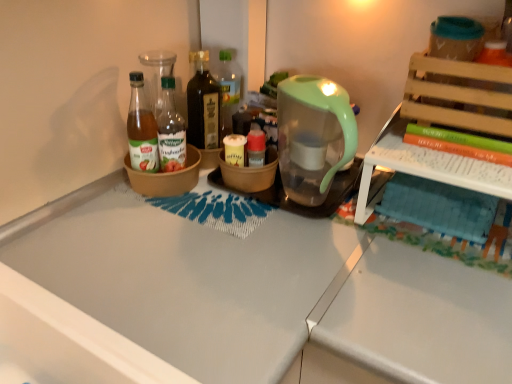
What do you see at coordinates (313, 136) in the screenshot?
I see `translucent green coffeepot at upper right` at bounding box center [313, 136].

What do you see at coordinates (228, 87) in the screenshot?
I see `translucent glass bottle at center, acting as the 3th bottle starting from the left` at bounding box center [228, 87].

Describe the element at coordinates (203, 104) in the screenshot. The width and height of the screenshot is (512, 384). I see `dark brown glass bottle at center, placed as the 2th bottle when sorted from left to right` at that location.

Where is `green glass bottle at center, which is the 1th bottle from left to right`? Image resolution: width=512 pixels, height=384 pixels. green glass bottle at center, which is the 1th bottle from left to right is located at coordinates click(170, 130).

Find the location of a particular element. Image resolution: width=512 pixels, height=384 pixels. green matte book at upper right is located at coordinates (460, 143).

This screenshot has width=512, height=384. Find the location of `translucent green coffeepot at upper right`. translucent green coffeepot at upper right is located at coordinates (313, 136).

Can you confirm if green matte book at upper right is positioned to the right of green glass bottle at center, which is counted as the third bottle, starting from the right?

Correct, you'll find green matte book at upper right to the right of green glass bottle at center, which is counted as the third bottle, starting from the right.

Identify the location of book in front of the green glass bottle at center, which is counted as the third bottle, starting from the right. (460, 143).

Can you see green matte book at upper right touching green glass bottle at center, which is counted as the third bottle, starting from the right?

There is a gap between green matte book at upper right and green glass bottle at center, which is counted as the third bottle, starting from the right.

Who is smaller, green glass bottle at center, which is counted as the third bottle, starting from the right, or translucent glass bottle at center, acting as the 3th bottle starting from the left?

Smaller between the two is green glass bottle at center, which is counted as the third bottle, starting from the right.

Is green glass bottle at center, which is the 1th bottle from left to right, outside of translucent glass bottle at center, which ranks as the first bottle in right-to-left order?

green glass bottle at center, which is the 1th bottle from left to right, lies outside translucent glass bottle at center, which ranks as the first bottle in right-to-left order,'s area.

Is point (182, 162) less distant than point (224, 61)?

That is True.

Looking at their sizes, would you say green glass bottle at center, which is counted as the third bottle, starting from the right, is wider or thinner than translucent glass bottle at center, which ranks as the first bottle in right-to-left order?

Considering their sizes, green glass bottle at center, which is counted as the third bottle, starting from the right, looks slimmer than translucent glass bottle at center, which ranks as the first bottle in right-to-left order.

In the scene shown: Considering the relative positions of brown matte bowl at center, acting as the 2th bowl starting from the left, and translucent glass bottle at center, which ranks as the first bottle in right-to-left order, in the image provided, is brown matte bowl at center, acting as the 2th bowl starting from the left, to the left of translucent glass bottle at center, which ranks as the first bottle in right-to-left order, from the viewer's perspective?

In fact, brown matte bowl at center, acting as the 2th bowl starting from the left, is to the right of translucent glass bottle at center, which ranks as the first bottle in right-to-left order.

Is brown matte bowl at center, acting as the 2th bowl starting from the left, turned away from translucent glass bottle at center, acting as the 3th bottle starting from the left?

Absolutely, brown matte bowl at center, acting as the 2th bowl starting from the left, is directed away from translucent glass bottle at center, acting as the 3th bottle starting from the left.

Does point (271, 157) come closer to viewer compared to point (219, 70)?

Yes, point (271, 157) is in front of point (219, 70).

Is green glass bottle at center, which is counted as the third bottle, starting from the right, facing away from green matte book at upper right?

No.

Consider the image. Does green glass bottle at center, which is counted as the third bottle, starting from the right, have a larger size compared to green matte book at upper right?

Actually, green glass bottle at center, which is counted as the third bottle, starting from the right, might be smaller than green matte book at upper right.

From the image's perspective, would you say green glass bottle at center, which is counted as the third bottle, starting from the right, is positioned over green matte book at upper right?

Correct, green glass bottle at center, which is counted as the third bottle, starting from the right, appears higher than green matte book at upper right in the image.

How distant is green glass bottle at center, which is counted as the third bottle, starting from the right, from green matte book at upper right?

They are 56.14 centimeters apart.

Which of these two, dark brown glass bottle at center, placed as the 2th bottle when sorted from left to right, or green matte book at upper right, is smaller?

Smaller between the two is green matte book at upper right.

From the picture: Is dark brown glass bottle at center, the second bottle in the right-to-left sequence, not within green matte book at upper right?

Yes, dark brown glass bottle at center, the second bottle in the right-to-left sequence, is outside of green matte book at upper right.

Is dark brown glass bottle at center, placed as the 2th bottle when sorted from left to right, touching green matte book at upper right?

dark brown glass bottle at center, placed as the 2th bottle when sorted from left to right, and green matte book at upper right are not in contact.

Between dark brown glass bottle at center, the second bottle in the right-to-left sequence, and green matte book at upper right, which one has more height?

dark brown glass bottle at center, the second bottle in the right-to-left sequence.

Is brown ceramic bowl at center, placed as the 1th bowl when sorted from left to right, located outside green matte book at upper right?

Yes, brown ceramic bowl at center, placed as the 1th bowl when sorted from left to right, is not within green matte book at upper right.

Which is behind, brown ceramic bowl at center, placed as the 1th bowl when sorted from left to right, or green matte book at upper right?

brown ceramic bowl at center, placed as the 1th bowl when sorted from left to right, is behind.

Based on the photo, could you tell me if brown ceramic bowl at center, acting as the second bowl starting from the right, is facing green matte book at upper right?

No.

Considering the relative sizes of brown ceramic bowl at center, acting as the second bowl starting from the right, and green matte book at upper right in the image provided, is brown ceramic bowl at center, acting as the second bowl starting from the right, wider than green matte book at upper right?

No.

How distant is translucent glass bottle at center, which ranks as the first bottle in right-to-left order, from translucent green coffeepot at upper right?

translucent glass bottle at center, which ranks as the first bottle in right-to-left order, is 10.45 inches away from translucent green coffeepot at upper right.

Can you confirm if translucent glass bottle at center, which ranks as the first bottle in right-to-left order, is shorter than translucent green coffeepot at upper right?

No.

Choose the correct answer: Is translucent glass bottle at center, acting as the 3th bottle starting from the left, inside translucent green coffeepot at upper right or outside it?

translucent glass bottle at center, acting as the 3th bottle starting from the left, lies outside translucent green coffeepot at upper right.

From the image's perspective, is translucent glass bottle at center, which ranks as the first bottle in right-to-left order, positioned above or below translucent green coffeepot at upper right?

translucent glass bottle at center, which ranks as the first bottle in right-to-left order, is situated higher than translucent green coffeepot at upper right in the image.

Image resolution: width=512 pixels, height=384 pixels. Identify the location of the 1st bottle behind when counting from the green matte book at upper right. (170, 130).

The width and height of the screenshot is (512, 384). In order to click on the 2nd bottle to the right when counting from the green glass bottle at center, which is counted as the third bottle, starting from the right in this screenshot , I will do `click(228, 87)`.

Estimate the real-world distances between objects in this image. Which object is further from translucent glass bottle at center, acting as the 3th bottle starting from the left, brown matte bowl at center, which is the 1th bowl from right to left, or green glass bottle at center, which is counted as the third bottle, starting from the right?

Based on the image, brown matte bowl at center, which is the 1th bowl from right to left, appears to be further to translucent glass bottle at center, acting as the 3th bottle starting from the left.

Based on their spatial positions, is brown ceramic bowl at center, placed as the 1th bowl when sorted from left to right, or brown matte bowl at center, acting as the 2th bowl starting from the left, further from translucent green coffeepot at upper right?

brown ceramic bowl at center, placed as the 1th bowl when sorted from left to right, lies further to translucent green coffeepot at upper right than the other object.

From the image, which object appears to be nearer to green glass bottle at center, which is the 1th bottle from left to right, translucent glass bottle at center, acting as the 3th bottle starting from the left, or dark brown glass bottle at center, placed as the 2th bottle when sorted from left to right?

dark brown glass bottle at center, placed as the 2th bottle when sorted from left to right.

Looking at the image, which one is located further to dark brown glass bottle at center, placed as the 2th bottle when sorted from left to right, translucent glass bottle at center, which ranks as the first bottle in right-to-left order, or translucent green coffeepot at upper right?

translucent green coffeepot at upper right lies further to dark brown glass bottle at center, placed as the 2th bottle when sorted from left to right, than the other object.

Considering their positions, is translucent glass bottle at center, acting as the 3th bottle starting from the left, positioned closer to brown ceramic bowl at center, acting as the second bowl starting from the right, than brown matte bowl at center, which is the 1th bowl from right to left?

The object closer to brown ceramic bowl at center, acting as the second bowl starting from the right, is brown matte bowl at center, which is the 1th bowl from right to left.

When comparing their distances from brown matte bowl at center, acting as the 2th bowl starting from the left, does translucent glass bottle at center, acting as the 3th bottle starting from the left, or green matte book at upper right seem further?

Based on the image, green matte book at upper right appears to be further to brown matte bowl at center, acting as the 2th bowl starting from the left.

Based on their spatial positions, is brown ceramic bowl at center, placed as the 1th bowl when sorted from left to right, or translucent glass bottle at center, which ranks as the first bottle in right-to-left order, further from dark brown glass bottle at center, placed as the 2th bottle when sorted from left to right?

brown ceramic bowl at center, placed as the 1th bowl when sorted from left to right, is further to dark brown glass bottle at center, placed as the 2th bottle when sorted from left to right.

Considering their positions, is translucent green coffeepot at upper right positioned further to dark brown glass bottle at center, placed as the 2th bottle when sorted from left to right, than green matte book at upper right?

green matte book at upper right is positioned further to the anchor dark brown glass bottle at center, placed as the 2th bottle when sorted from left to right.

Image resolution: width=512 pixels, height=384 pixels. What are the coordinates of `bowl located between green glass bottle at center, which is the 1th bottle from left to right, and translucent green coffeepot at upper right in the left-right direction` in the screenshot? It's located at (250, 173).

You are a GUI agent. You are given a task and a screenshot of the screen. Output one action in this format:
    pyautogui.click(x=<x>, y=<y>)
    Task: Click on the coffeepot between brown matte bowl at center, which is the 1th bowl from right to left, and green matte book at upper right, in the horizontal direction
    This screenshot has width=512, height=384.
    Given the screenshot: What is the action you would take?
    pyautogui.click(x=313, y=136)

You are a GUI agent. You are given a task and a screenshot of the screen. Output one action in this format:
    pyautogui.click(x=<x>, y=<y>)
    Task: Click on the coffeepot situated between green glass bottle at center, which is counted as the third bottle, starting from the right, and green matte book at upper right from left to right
    This screenshot has width=512, height=384.
    Given the screenshot: What is the action you would take?
    pyautogui.click(x=313, y=136)

Identify the location of bowl between dark brown glass bottle at center, the second bottle in the right-to-left sequence, and green matte book at upper right from left to right. The width and height of the screenshot is (512, 384). tap(250, 173).